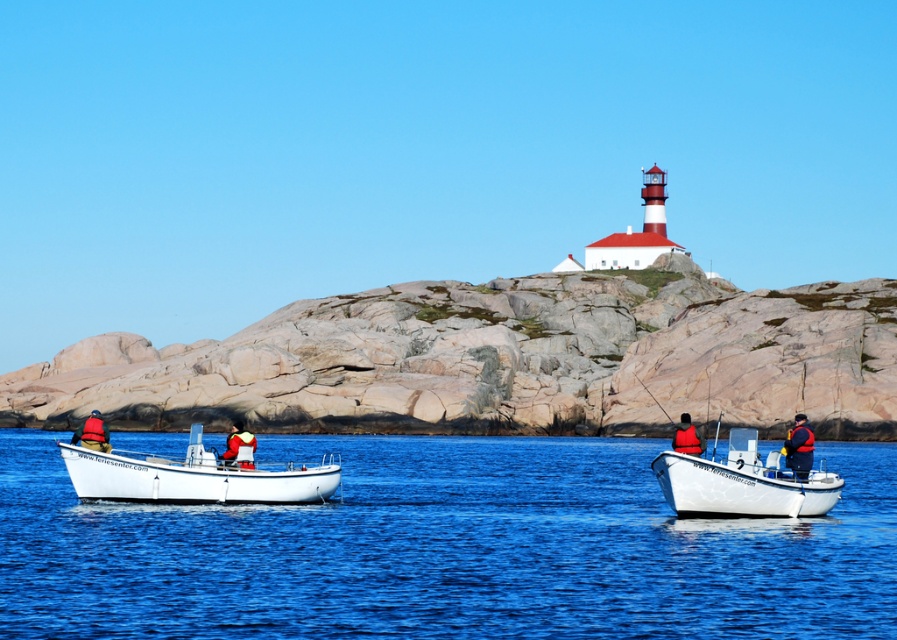
Looking at this image, you are standing at the point marked as point (445,548) in the image. Looking around, you see blue water at center. What direction should you face to see the boats?

The point (445,548) indicates blue water at center. Since the boats are in the foreground, facing away from the center blue water would allow you to see the boats.

You are a safety inspector checking the spacing between the red life vest at left and the red life vest at center on the boat. The safety regulation requires at least 100 feet between life vests for safety. Is the current spacing compliant with the regulation?

The distance between the red life vest at left and the red life vest at center is 95.52 feet, which is less than the required 100 feet. Therefore, the current spacing does not comply with the safety regulation.